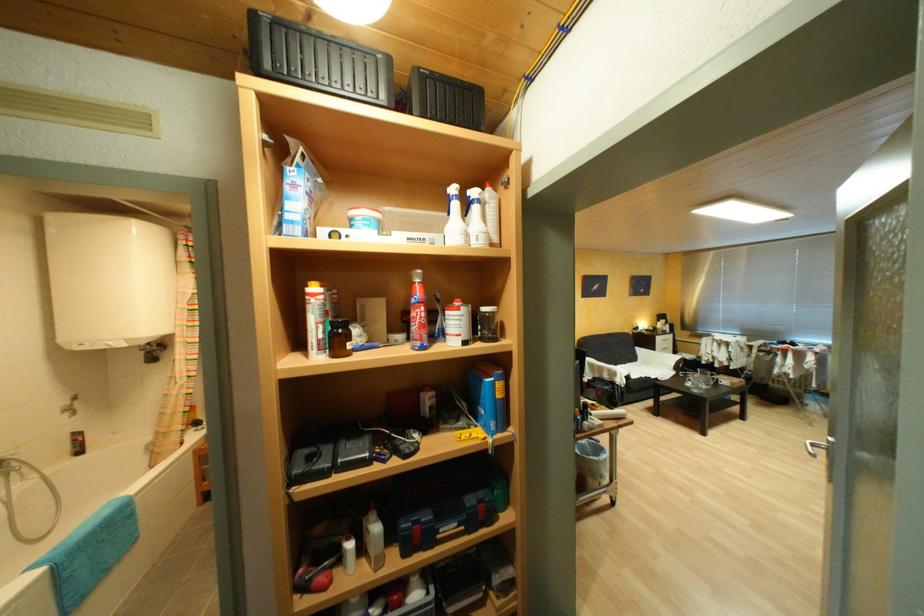
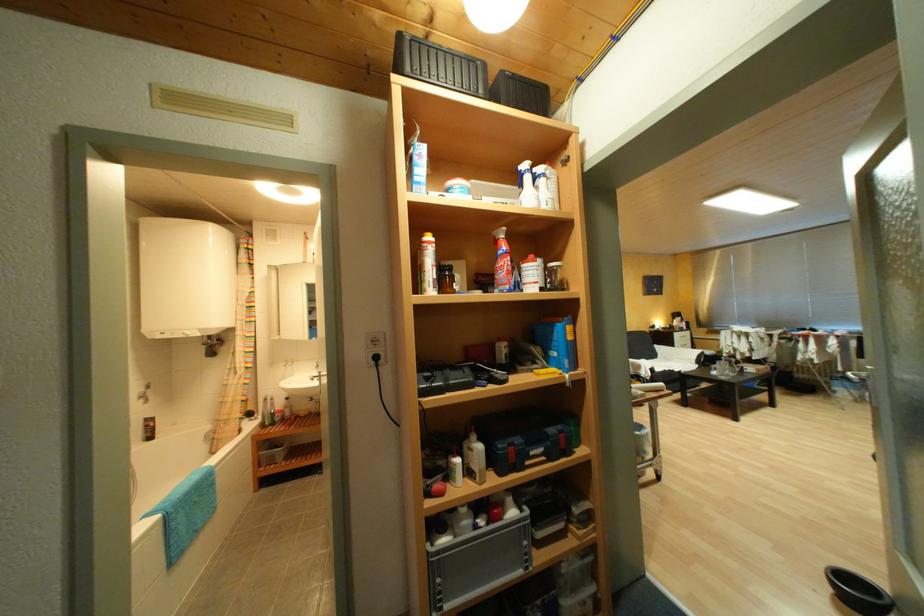
Which direction would the cameraman need to move to produce the second image?

The cameraman walked toward left, backward.